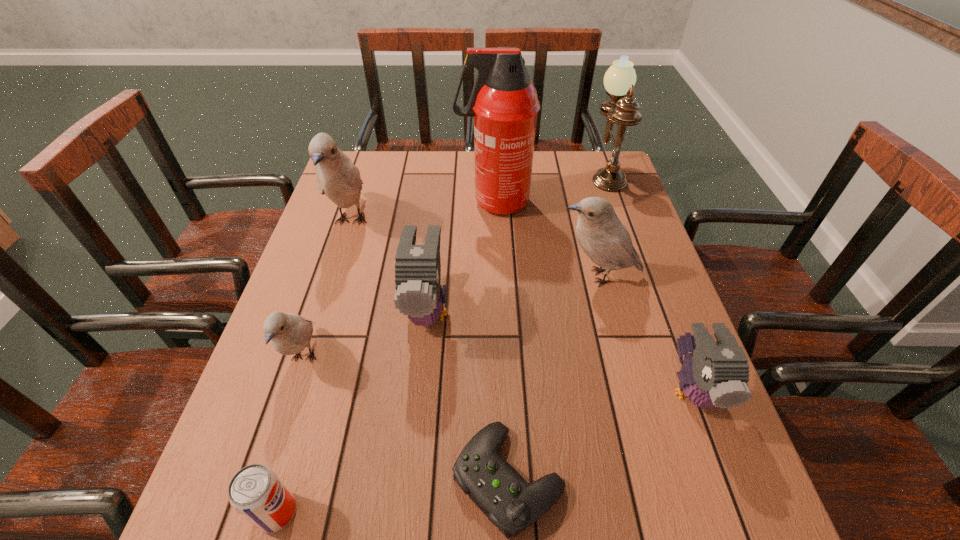
Find the location of a particular element. This screenshot has width=960, height=540. the third closest object to the smaller gray bird is located at coordinates tap(419, 295).

Identify which object is located as the nearest to the tallest object. Please provide its 2D coordinates. Your answer should be formatted as a tuple, i.e. [(x, y)], where the tuple contains the x and y coordinates of a point satisfying the conditions above.

[(602, 236)]

Select which bird appears as the third closest to the smallest white bird. Please provide its 2D coordinates. Your answer should be formatted as a tuple, i.e. [(x, y)], where the tuple contains the x and y coordinates of a point satisfying the conditions above.

[(602, 236)]

This screenshot has width=960, height=540. I want to click on bird object that ranks as the second closest to the soda, so click(419, 295).

Identify the location of the closest white bird to the biggest white bird. The height and width of the screenshot is (540, 960). (290, 334).

Find the location of a particular element. This screenshot has height=540, width=960. white bird that stands as the closest to the farthest bird is located at coordinates (290, 334).

Locate an element on the screen. The image size is (960, 540). vacant region that satisfies the following two spatial constraints: 1. at the beak of the farthest bird; 2. on the left side of the eighth tallest object is located at coordinates (257, 512).

Locate an element on the screen. Image resolution: width=960 pixels, height=540 pixels. vacant region that satisfies the following two spatial constraints: 1. on the trigger side of the fire extinguisher; 2. at the beak of the left gray bird is located at coordinates (498, 310).